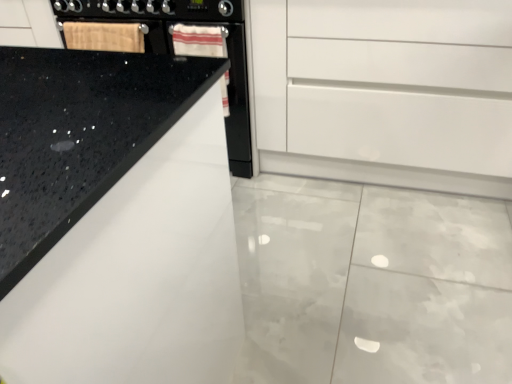
At what (x,y) coordinates should I click in order to perform the action: click on vacant space situated above wooden cutting board at upper left (from a real-world perspective). Please return your answer as a coordinate pair (x, y). The image size is (512, 384). Looking at the image, I should click on (95, 19).